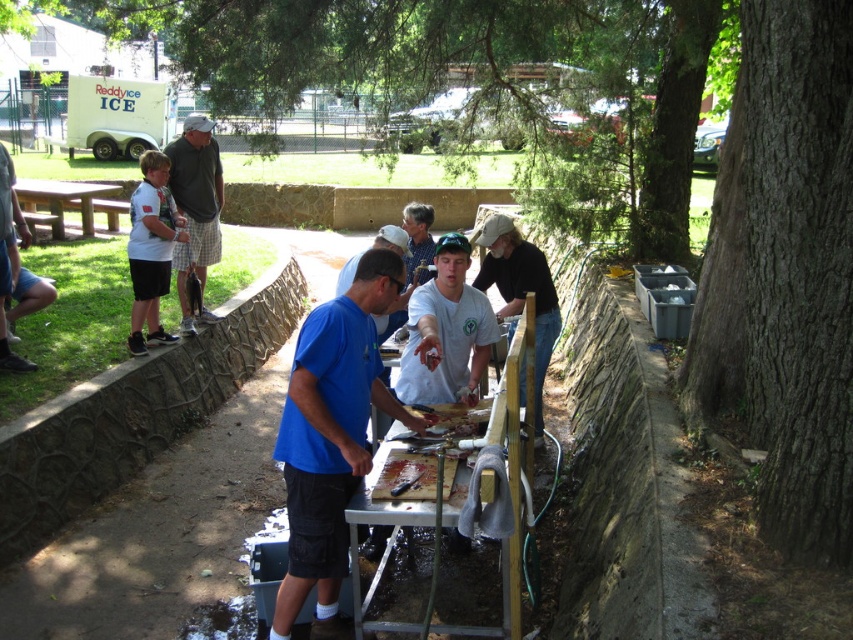
You are a photographer standing in the park scene and want to take a photo of both the gray flannel shirt at upper left and the white cotton shirt at left. Which shirt should you adjust your camera focus on first to ensure both are in the frame?

You should focus on the gray flannel shirt at upper left first because it is closer to the viewer than the white cotton shirt at left, ensuring both shirts are within the camera frame.

You are a participant in the activity and need to reach the gray flannel shirt at upper left to wipe your hands. The brown wooden table at left is in your path. Which side of the table should you go around to access the shirt?

The gray flannel shirt at upper left is positioned on the right side of the brown wooden table at left, so you should go around the right side of the brown wooden table at left to reach it.